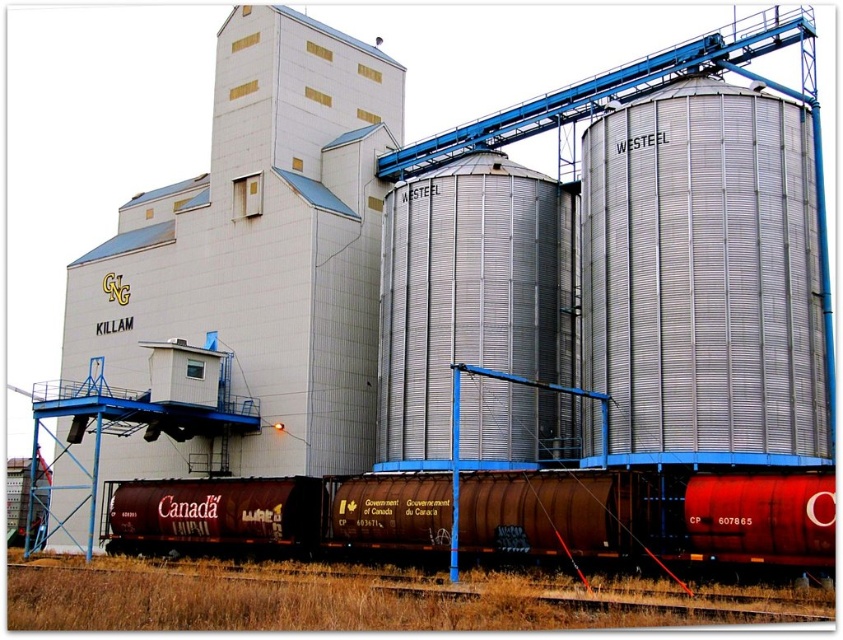
This screenshot has width=843, height=640. Identify the location of silver/aluminum silo at right. (704, 273).

The image size is (843, 640). In order to click on silver/aluminum silo at right in this screenshot , I will do `click(704, 273)`.

Who is taller, silver/aluminum silo at right or rusty metal train car at lower center?

With more height is silver/aluminum silo at right.

Which is above, silver/aluminum silo at right or rusty metal train car at lower center?

silver/aluminum silo at right is higher up.

Is point (595, 205) less distant than point (823, 506)?

No.

You are a GUI agent. You are given a task and a screenshot of the screen. Output one action in this format:
    pyautogui.click(x=<x>, y=<y>)
    Task: Click on the silver/aluminum silo at right
    
    Given the screenshot: What is the action you would take?
    pyautogui.click(x=704, y=273)

Can you confirm if silver metallic silo at center is taller than brown rusted metal train track at lower center?

Yes, silver metallic silo at center is taller than brown rusted metal train track at lower center.

Does silver metallic silo at center appear on the right side of brown rusted metal train track at lower center?

Correct, you'll find silver metallic silo at center to the right of brown rusted metal train track at lower center.

Who is more distant from viewer, (484, 275) or (201, 605)?

The point (484, 275) is behind.

Where is `silver metallic silo at center`? silver metallic silo at center is located at coordinates (466, 294).